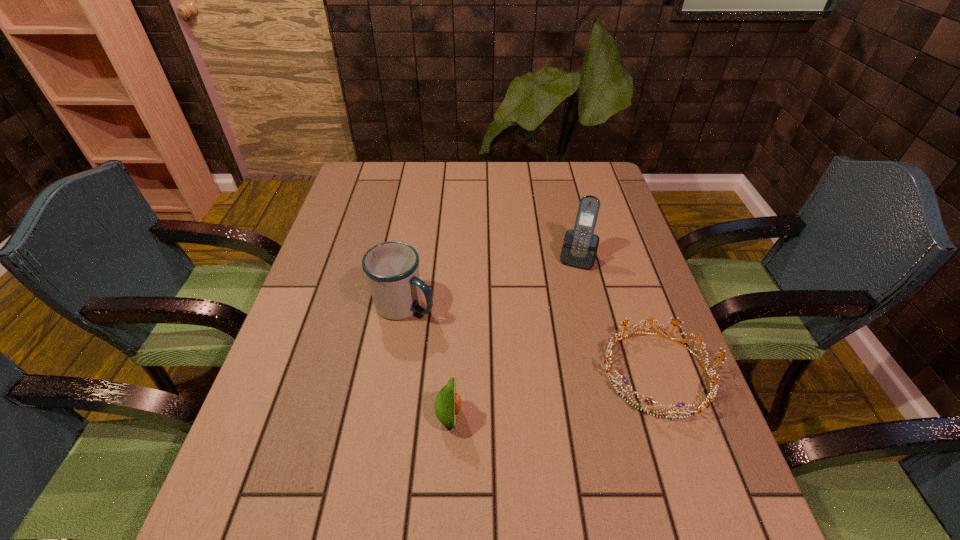
Locate an element on the screen. This screenshot has height=540, width=960. free point located on the front-facing side of the farthest object is located at coordinates (561, 308).

Identify the location of vacant space situated 0.160m on the front-facing side of the farthest object. (560, 311).

Image resolution: width=960 pixels, height=540 pixels. Identify the location of vacant space located on the front-facing side of the farthest object. (559, 314).

Where is `object present at the near edge`? This screenshot has width=960, height=540. object present at the near edge is located at coordinates (447, 404).

Find the location of a particular element. This screenshot has width=960, height=540. tiara that is at the right edge is located at coordinates (712, 392).

Find the location of a particular element. The image size is (960, 540). cellular telephone situated at the right edge is located at coordinates (580, 245).

The height and width of the screenshot is (540, 960). What are the coordinates of `vacant region at the far edge of the desktop` in the screenshot? It's located at coord(459,177).

Locate an element on the screen. free space at the near edge of the desktop is located at coordinates (546, 478).

This screenshot has height=540, width=960. Find the location of `vacant area at the left edge`. vacant area at the left edge is located at coordinates (337, 298).

Where is `vacant space at the right edge of the desktop`? vacant space at the right edge of the desktop is located at coordinates tap(688, 392).